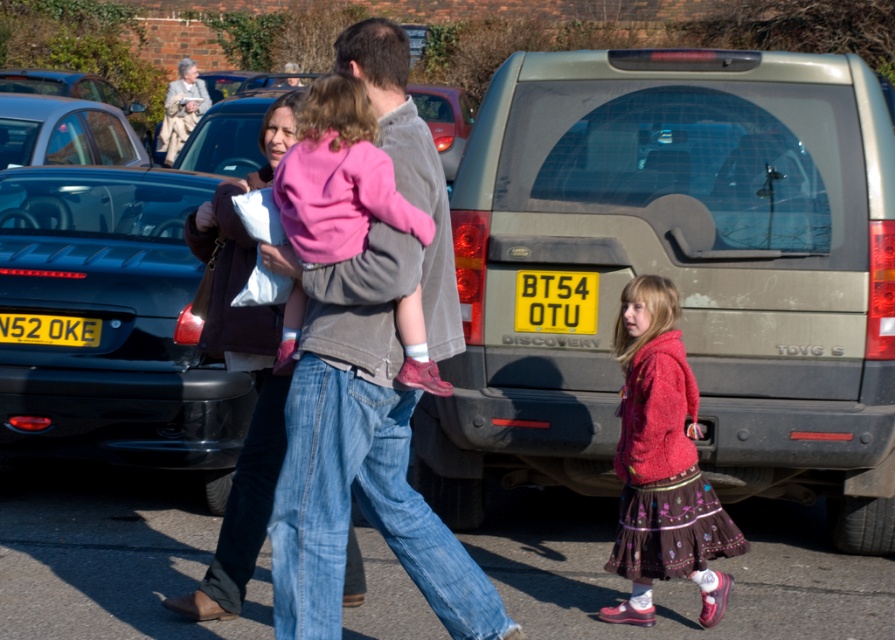
You are standing at the point labeled point [171,128] and want to walk to the point labeled point [28,339]. According to the scene, will you be moving towards the background or the foreground?

Since point [171,128] is further to the viewer than point [28,339], moving from point [171,128] to point [28,339] means you are moving towards the foreground.

You are standing at the point marked as point (857,253) in the parking lot scene. You need to walk to the parking lot entrance located 5 meters away from you. Can you reach the entrance without moving more than 5 meters?

The distance of point (857,253) from viewer is 5.08 meters, so you are already 5.08 meters away from the entrance. Since you can only move 5 meters, you cannot reach the entrance without exceeding the distance limit.